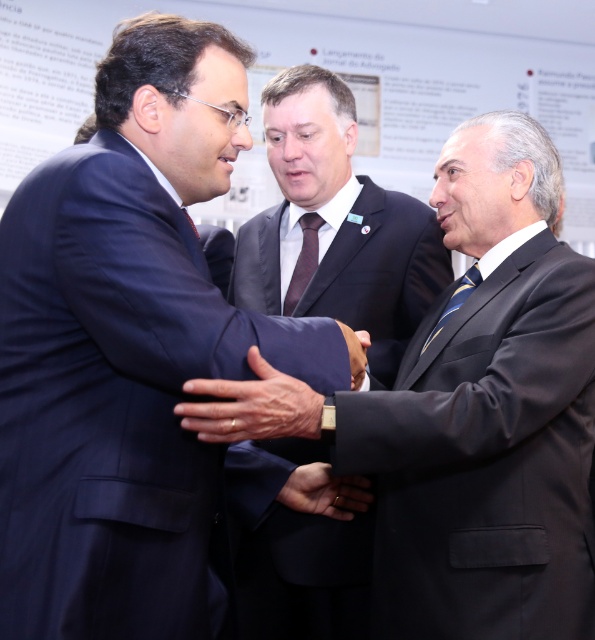
In the professional setting depicted, there are two men wearing dark blue suit at center and navy blue suit at center. Which one is positioned to the left?

The dark blue suit at center is positioned to the left of the navy blue suit at center.